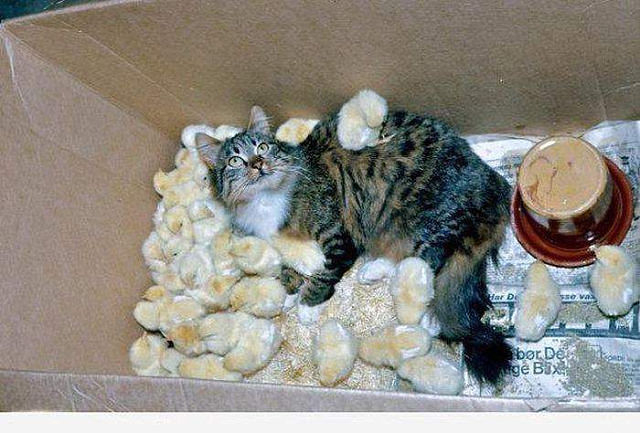
Where is `newspaper`? The image size is (640, 433). newspaper is located at coordinates (545, 372), (604, 327), (505, 155), (630, 141).